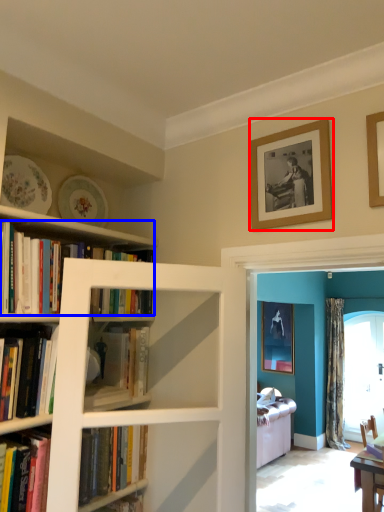
Question: Among these objects, which one is nearest to the camera, picture frame (highlighted by a red box) or book (highlighted by a blue box)?

Choices:
 (A) picture frame
 (B) book

Answer: (B)